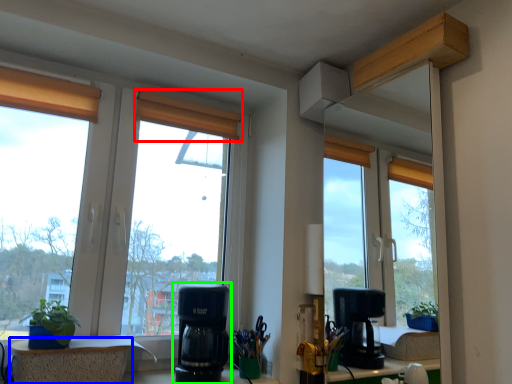
Question: Based on their relative distances, which object is nearer to curtain (highlighted by a red box)? Choose from window (highlighted by a blue box) and coffee maker (highlighted by a green box).

Choices:
 (A) window
 (B) coffee maker

Answer: (B)